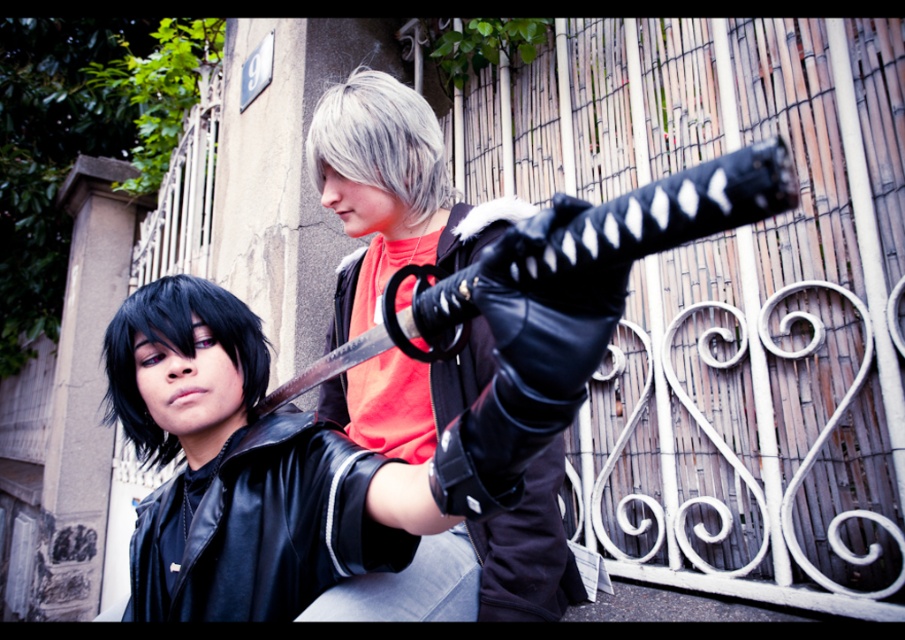
Who is more forward, [280,502] or [424,179]?

Point [280,502]

Who is lower down, black leather jacket at center or silverhair at center?

black leather jacket at center is lower down.

Between point (208, 509) and point (418, 193), which one is positioned in front?

Point (208, 509) is in front.

Where is `black leather jacket at center`? This screenshot has width=905, height=640. black leather jacket at center is located at coordinates tap(265, 528).

Is silverhair at center below black matte hair at center?

No.

Describe the element at coordinates (380, 141) in the screenshot. This screenshot has width=905, height=640. I see `silverhair at center` at that location.

Does point (375, 124) come farther from viewer compared to point (132, 298)?

That is True.

Locate an element on the screen. silverhair at center is located at coordinates (380, 141).

Does black leather glove at center have a lesser width compared to black leather jacket at center?

Indeed, black leather glove at center has a lesser width compared to black leather jacket at center.

Looking at this image, which is above, black leather glove at center or black leather jacket at center?

Positioned higher is black leather glove at center.

At what (x,y) coordinates should I click in order to perform the action: click on black leather glove at center. Please return your answer as a coordinate pair (x, y). This screenshot has height=640, width=905. Looking at the image, I should click on (389, 192).

At what (x,y) coordinates should I click in order to perform the action: click on black leather glove at center. Please return your answer as a coordinate pair (x, y). The image size is (905, 640). Looking at the image, I should click on (389, 192).